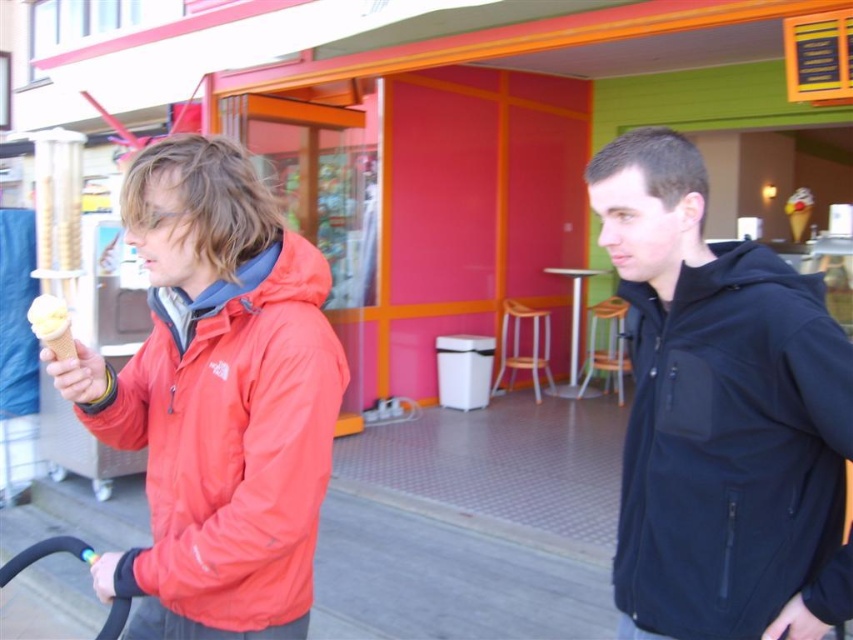
Question: From the image, what is the correct spatial relationship of matte black jacket at right in relation to matte red jacket at left?

Choices:
 (A) below
 (B) above

Answer: (B)

Question: Which object is farther from the camera taking this photo?

Choices:
 (A) vanilla ice cream in waffle cone at left
 (B) yellow waffle cone at right
 (C) matte red jacket at left
 (D) matte black jacket at right

Answer: (B)

Question: Does vanilla ice cream in waffle cone at left appear over yellow waffle cone at right?

Choices:
 (A) no
 (B) yes

Answer: (A)

Question: Does matte black jacket at right have a smaller size compared to matte red jacket at left?

Choices:
 (A) yes
 (B) no

Answer: (A)

Question: Based on their relative distances, which object is nearer to the yellow waffle cone at right?

Choices:
 (A) matte red jacket at left
 (B) vanilla ice cream in waffle cone at left
 (C) matte black jacket at right

Answer: (C)

Question: Which object is the closest to the vanilla ice cream in waffle cone at left?

Choices:
 (A) matte red jacket at left
 (B) matte black jacket at right
 (C) yellow waffle cone at right

Answer: (A)